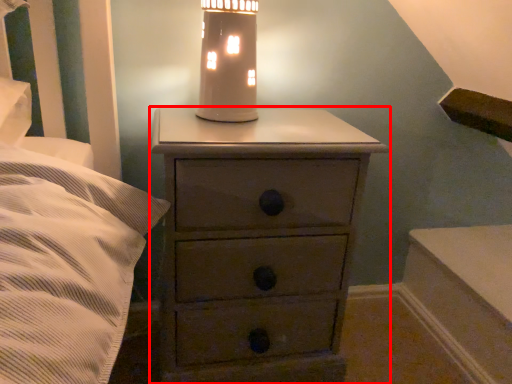
Question: From the image's perspective, where is chest of drawers (annotated by the red box) located in relation to oil lamp in the image?

Choices:
 (A) above
 (B) below

Answer: (B)